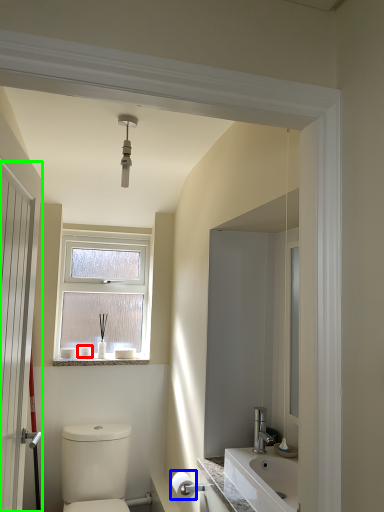
Question: Based on their relative distances, which object is farther from toiletry (highlighted by a red box)? Choose from toilet paper (highlighted by a blue box) and door (highlighted by a green box).

Choices:
 (A) toilet paper
 (B) door

Answer: (B)